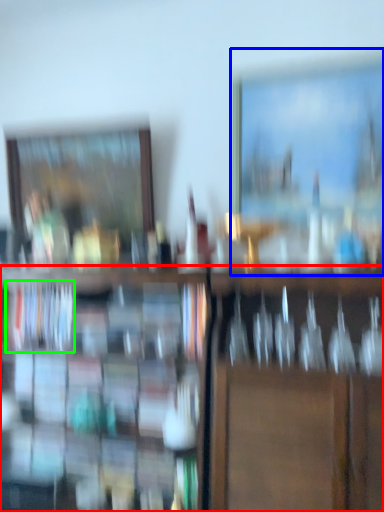
Question: Which object is positioned closest to shelf (highlighted by a red box)? Select from picture frame (highlighted by a blue box) and book (highlighted by a green box).

Choices:
 (A) picture frame
 (B) book

Answer: (B)